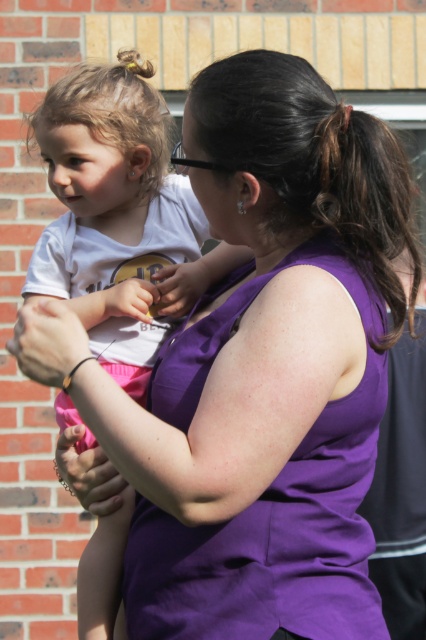
You are a fashion designer observing the scene. You need to determine which object has a greater width between the white matte shirt at left and the dark brown hair at upper center without measuring tools. How can you compare their widths using the available information?

The white matte shirt at left has a greater width than the dark brown hair at upper center according to the description provided.

You are a photographer trying to capture the scene. You notice the white matte shirt at left and the dark brown hair at upper center. Which object should you focus on if you want to highlight something larger in the frame?

The white matte shirt at left is larger than the dark brown hair at upper center, so focusing on the white matte shirt at left would highlight the larger object.